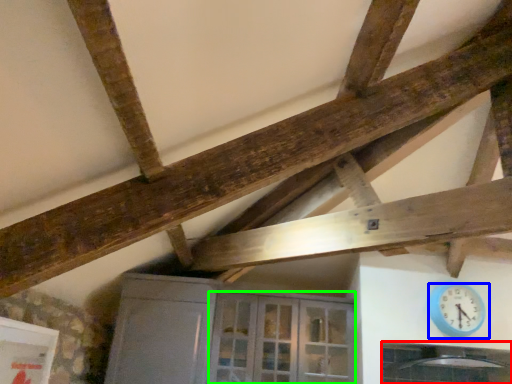
Question: Estimate the real-world distances between objects in this image. Which object is farther from window (highlighted by a red box), wall clock (highlighted by a blue box) or glass door (highlighted by a green box)?

Choices:
 (A) wall clock
 (B) glass door

Answer: (B)